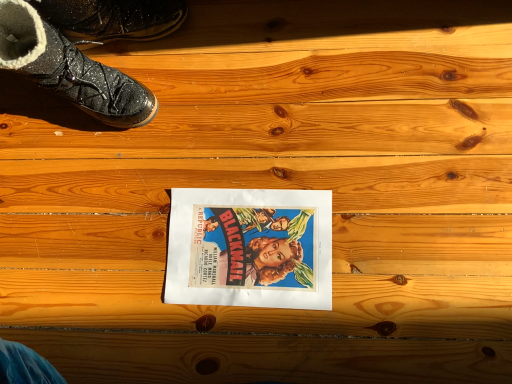
Identify the location of matte paper movie poster at center. (249, 248).

Is shiny black boot at upper left, which is the 2th footwear from top to bottom, wider than sparkly black boot at upper left, placed as the 2th footwear when sorted from bottom to top?

Yes.

From the image's perspective, between shiny black boot at upper left, which is the 2th footwear from top to bottom, and sparkly black boot at upper left, which is the 1th footwear from top to bottom, who is located below?

shiny black boot at upper left, which is the 2th footwear from top to bottom.

From a real-world perspective, who is located higher, shiny black boot at upper left, which is the 2th footwear from top to bottom, or sparkly black boot at upper left, placed as the 2th footwear when sorted from bottom to top?

From a 3D spatial view, shiny black boot at upper left, which is the 2th footwear from top to bottom, is above.

Which is more to the right, shiny black boot at upper left, which is the 2th footwear from top to bottom, or matte paper movie poster at center?

matte paper movie poster at center is more to the right.

Is shiny black boot at upper left, the first footwear in the bottom-to-top sequence, bigger than matte paper movie poster at center?

Indeed, shiny black boot at upper left, the first footwear in the bottom-to-top sequence, has a larger size compared to matte paper movie poster at center.

Does shiny black boot at upper left, which is the 2th footwear from top to bottom, lie in front of matte paper movie poster at center?

Yes, it is in front of matte paper movie poster at center.

Does shiny black boot at upper left, the first footwear in the bottom-to-top sequence, have a greater width compared to matte paper movie poster at center?

Incorrect, the width of shiny black boot at upper left, the first footwear in the bottom-to-top sequence, does not surpass that of matte paper movie poster at center.

From the image's perspective, which one is positioned higher, matte paper movie poster at center or shiny black boot at upper left, which is the 2th footwear from top to bottom?

shiny black boot at upper left, which is the 2th footwear from top to bottom, from the image's perspective.

Is matte paper movie poster at center positioned before shiny black boot at upper left, the first footwear in the bottom-to-top sequence?

That is False.

Is point (233, 194) positioned in front of point (80, 87)?

No, (233, 194) is behind (80, 87).

From the image's perspective, starting from the matte paper movie poster at center, which footwear is the 1st one above? Please provide its 2D coordinates.

[(70, 69)]

From a real-world perspective, which object rests below the other?

In real-world perspective, sparkly black boot at upper left, which is the 1th footwear from top to bottom, is lower.

Can you confirm if sparkly black boot at upper left, placed as the 2th footwear when sorted from bottom to top, is smaller than shiny black boot at upper left, the first footwear in the bottom-to-top sequence?

Indeed, sparkly black boot at upper left, placed as the 2th footwear when sorted from bottom to top, has a smaller size compared to shiny black boot at upper left, the first footwear in the bottom-to-top sequence.

Is sparkly black boot at upper left, which is the 1th footwear from top to bottom, with shiny black boot at upper left, which is the 2th footwear from top to bottom?

Indeed, sparkly black boot at upper left, which is the 1th footwear from top to bottom, and shiny black boot at upper left, which is the 2th footwear from top to bottom, are beside each other and touching.

Which is more to the left, sparkly black boot at upper left, placed as the 2th footwear when sorted from bottom to top, or shiny black boot at upper left, which is the 2th footwear from top to bottom?

shiny black boot at upper left, which is the 2th footwear from top to bottom.

Looking at this image, is sparkly black boot at upper left, placed as the 2th footwear when sorted from bottom to top, positioned far away from matte paper movie poster at center?

Actually, sparkly black boot at upper left, placed as the 2th footwear when sorted from bottom to top, and matte paper movie poster at center are a little close together.

Is sparkly black boot at upper left, which is the 1th footwear from top to bottom, inside or outside of matte paper movie poster at center?

sparkly black boot at upper left, which is the 1th footwear from top to bottom, is spatially situated outside matte paper movie poster at center.

Could you tell me if sparkly black boot at upper left, placed as the 2th footwear when sorted from bottom to top, is facing matte paper movie poster at center?

No, sparkly black boot at upper left, placed as the 2th footwear when sorted from bottom to top, is not aimed at matte paper movie poster at center.

Is sparkly black boot at upper left, which is the 1th footwear from top to bottom, to the right of matte paper movie poster at center from the viewer's perspective?

No.

Can you tell me how much matte paper movie poster at center and sparkly black boot at upper left, placed as the 2th footwear when sorted from bottom to top, differ in facing direction?

They differ by 1.7 degrees in their facing directions.

Does point (201, 189) appear closer or farther from the camera than point (103, 2)?

Point (201, 189).

Is matte paper movie poster at center wider or thinner than sparkly black boot at upper left, which is the 1th footwear from top to bottom?

Clearly, matte paper movie poster at center has more width compared to sparkly black boot at upper left, which is the 1th footwear from top to bottom.

Locate an element on the screen. movie poster below the sparkly black boot at upper left, placed as the 2th footwear when sorted from bottom to top (from the image's perspective) is located at coordinates (249, 248).

Where is `footwear that is behind the shiny black boot at upper left, the first footwear in the bottom-to-top sequence`? The width and height of the screenshot is (512, 384). footwear that is behind the shiny black boot at upper left, the first footwear in the bottom-to-top sequence is located at coordinates (112, 19).

From a real-world perspective, starting from the matte paper movie poster at center, which footwear is the 2nd one vertically above it? Please provide its 2D coordinates.

[(70, 69)]

When comparing their distances from sparkly black boot at upper left, which is the 1th footwear from top to bottom, does shiny black boot at upper left, the first footwear in the bottom-to-top sequence, or matte paper movie poster at center seem closer?

shiny black boot at upper left, the first footwear in the bottom-to-top sequence, is positioned closer to the anchor sparkly black boot at upper left, which is the 1th footwear from top to bottom.

Which object lies nearer to the anchor point shiny black boot at upper left, which is the 2th footwear from top to bottom, sparkly black boot at upper left, which is the 1th footwear from top to bottom, or matte paper movie poster at center?

sparkly black boot at upper left, which is the 1th footwear from top to bottom, is closer to shiny black boot at upper left, which is the 2th footwear from top to bottom.

From the image, which object appears to be farther from matte paper movie poster at center, shiny black boot at upper left, which is the 2th footwear from top to bottom, or sparkly black boot at upper left, placed as the 2th footwear when sorted from bottom to top?

The object further to matte paper movie poster at center is sparkly black boot at upper left, placed as the 2th footwear when sorted from bottom to top.

Based on their spatial positions, is matte paper movie poster at center or shiny black boot at upper left, the first footwear in the bottom-to-top sequence, further from sparkly black boot at upper left, placed as the 2th footwear when sorted from bottom to top?

Based on the image, matte paper movie poster at center appears to be further to sparkly black boot at upper left, placed as the 2th footwear when sorted from bottom to top.

Based on their spatial positions, is matte paper movie poster at center or sparkly black boot at upper left, which is the 1th footwear from top to bottom, closer to shiny black boot at upper left, the first footwear in the bottom-to-top sequence?

sparkly black boot at upper left, which is the 1th footwear from top to bottom, is positioned closer to the anchor shiny black boot at upper left, the first footwear in the bottom-to-top sequence.

In the scene shown: Considering their positions, is sparkly black boot at upper left, placed as the 2th footwear when sorted from bottom to top, positioned closer to matte paper movie poster at center than shiny black boot at upper left, which is the 2th footwear from top to bottom?

The object closer to matte paper movie poster at center is shiny black boot at upper left, which is the 2th footwear from top to bottom.

The image size is (512, 384). Identify the location of footwear that lies between sparkly black boot at upper left, which is the 1th footwear from top to bottom, and matte paper movie poster at center from top to bottom. (x=70, y=69).